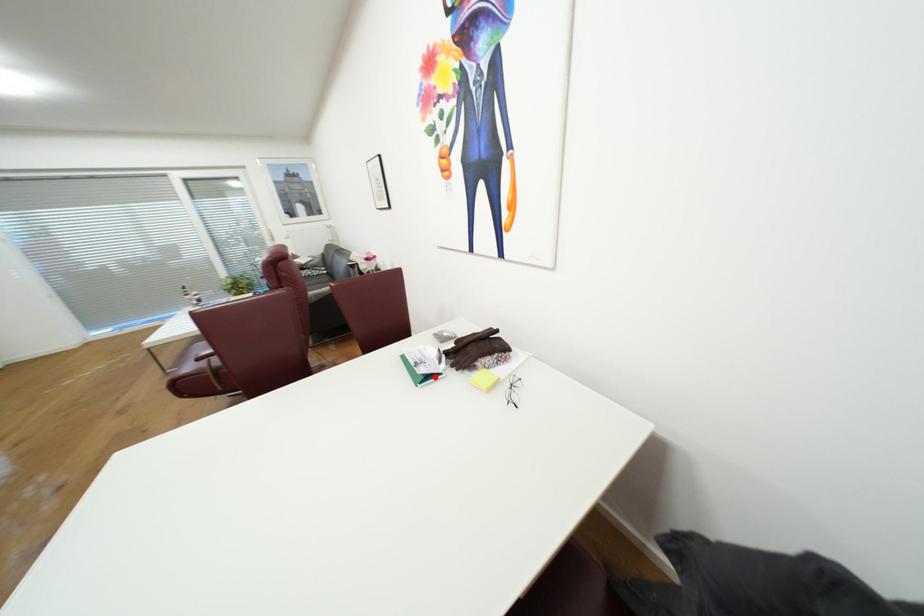
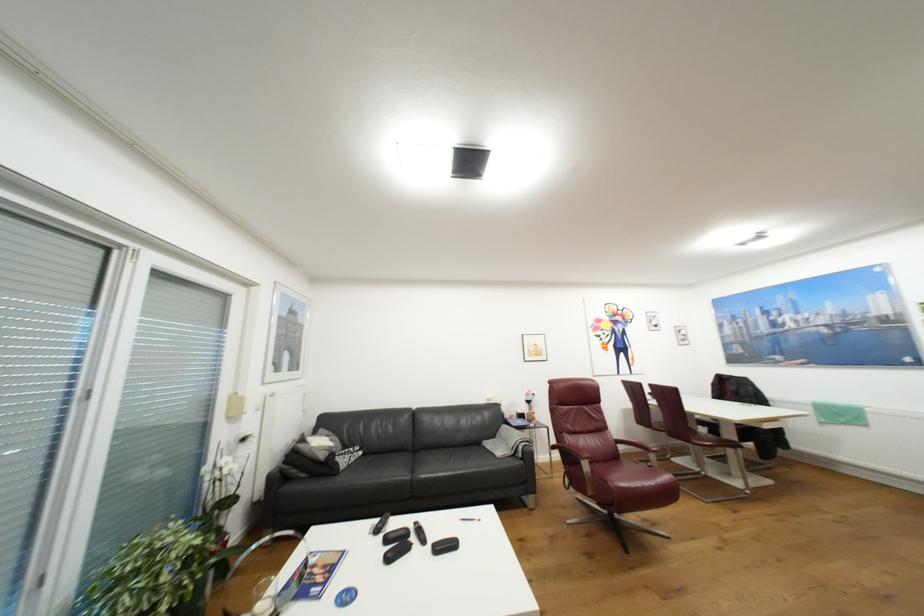
Question: I am providing you with two images of the same scene from different viewpoints. A red point is marked on the first image. Is the red point's position out of view in image 2?

Choices:
 (A) Yes
 (B) No

Answer: (A)